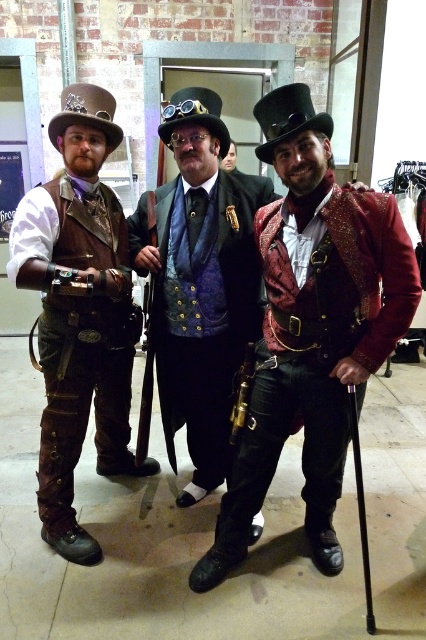
You are a photographer at the event and need to position the two subjects wearing the shiny red velvet jacket at center and the leather vest at left so that they can both fit within a wide shot. Based on their clothing, which subject should you place closer to the edges of the frame to ensure they don not overlap?

The shiny red velvet jacket at center might be wider than the leather vest at left, so you should position the subject in the shiny red velvet jacket at center closer to the edges to prevent overlapping since wider objects take up more space in the frame.